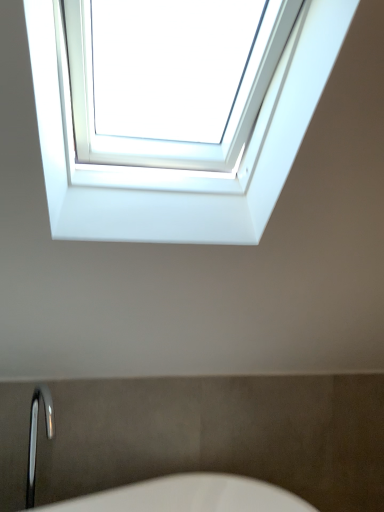
Question: Is polished chrome faucet at lower left bigger than white plastic window at upper center?

Choices:
 (A) yes
 (B) no

Answer: (B)

Question: Does polished chrome faucet at lower left come behind white plastic window at upper center?

Choices:
 (A) no
 (B) yes

Answer: (B)

Question: Are polished chrome faucet at lower left and white plastic window at upper center located far from each other?

Choices:
 (A) yes
 (B) no

Answer: (A)

Question: From a real-world perspective, is polished chrome faucet at lower left physically above white plastic window at upper center?

Choices:
 (A) no
 (B) yes

Answer: (A)

Question: Considering the relative sizes of polished chrome faucet at lower left and white plastic window at upper center in the image provided, is polished chrome faucet at lower left smaller than white plastic window at upper center?

Choices:
 (A) no
 (B) yes

Answer: (B)

Question: Can you confirm if polished chrome faucet at lower left is wider than white plastic window at upper center?

Choices:
 (A) yes
 (B) no

Answer: (B)

Question: Is polished chrome faucet at lower left a part of white plastic window at upper center?

Choices:
 (A) yes
 (B) no

Answer: (B)

Question: Is white plastic window at upper center located outside polished chrome faucet at lower left?

Choices:
 (A) no
 (B) yes

Answer: (B)

Question: From a real-world perspective, is white plastic window at upper center over polished chrome faucet at lower left?

Choices:
 (A) yes
 (B) no

Answer: (A)

Question: Is polished chrome faucet at lower left at the back of white plastic window at upper center?

Choices:
 (A) yes
 (B) no

Answer: (B)

Question: Is white plastic window at upper center bigger than polished chrome faucet at lower left?

Choices:
 (A) yes
 (B) no

Answer: (A)

Question: Is the position of white plastic window at upper center less distant than that of polished chrome faucet at lower left?

Choices:
 (A) no
 (B) yes

Answer: (B)

Question: From a real-world perspective, is polished chrome faucet at lower left above or below white plastic window at upper center?

Choices:
 (A) below
 (B) above

Answer: (A)